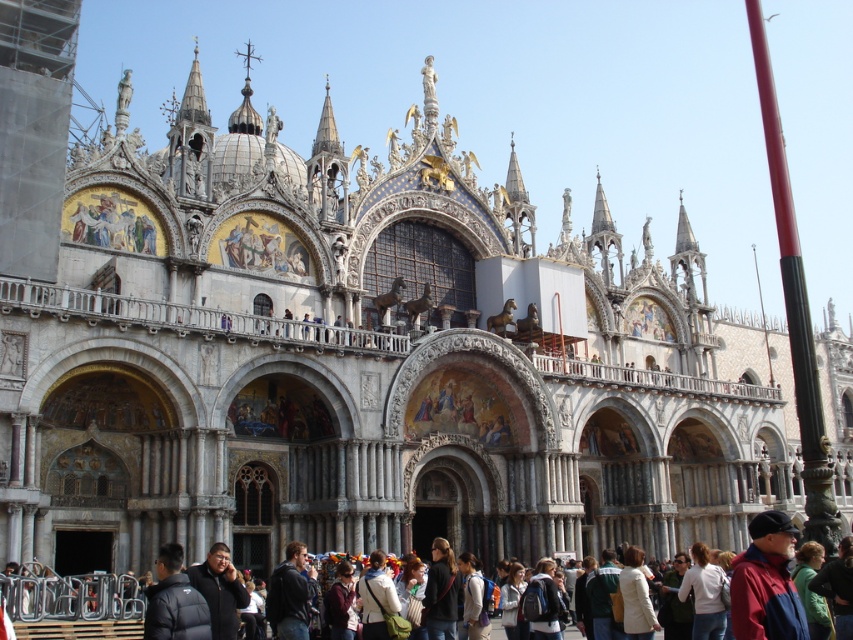
Question: Which object appears closest to the camera in this image?

Choices:
 (A) green fabric jacket at lower right
 (B) white cotton shirt at lower right
 (C) white matte jacket at lower center
 (D) dark gray hoodie at center

Answer: (A)

Question: Can you confirm if dark gray hoodie at center is smaller than white matte jacket at lower center?

Choices:
 (A) no
 (B) yes

Answer: (A)

Question: Considering the real-world distances, which object is closest to the green fabric jacket at lower right?

Choices:
 (A) white matte jacket at lower center
 (B) white cotton shirt at lower right

Answer: (B)

Question: Estimate the real-world distances between objects in this image. Which object is closer to the dark gray hoodie at center?

Choices:
 (A) white cotton shirt at lower right
 (B) green fabric jacket at lower right

Answer: (A)

Question: Is dark gray hoodie at center bigger than green fabric jacket at lower right?

Choices:
 (A) no
 (B) yes

Answer: (B)

Question: Is white cotton shirt at lower right to the left of white matte jacket at lower center from the viewer's perspective?

Choices:
 (A) no
 (B) yes

Answer: (A)